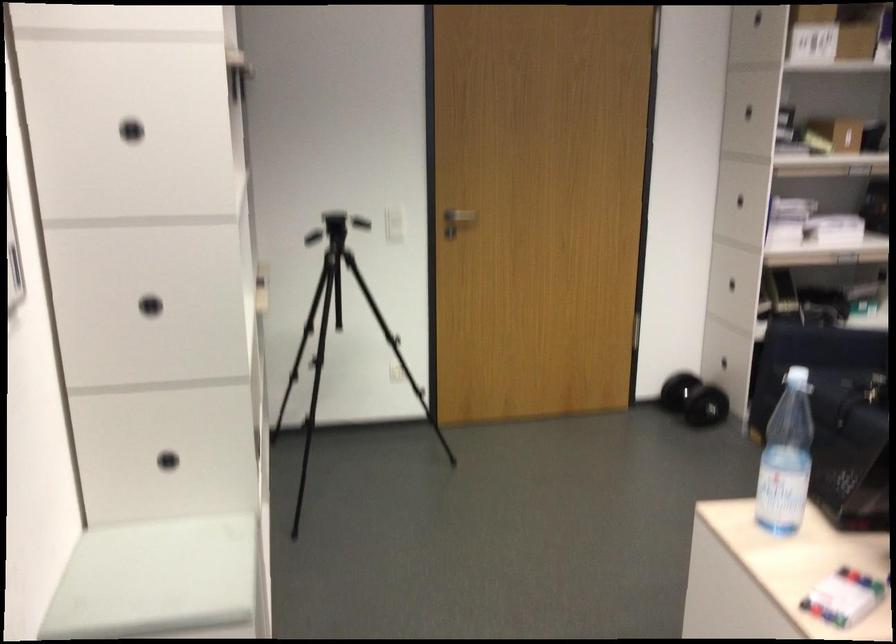
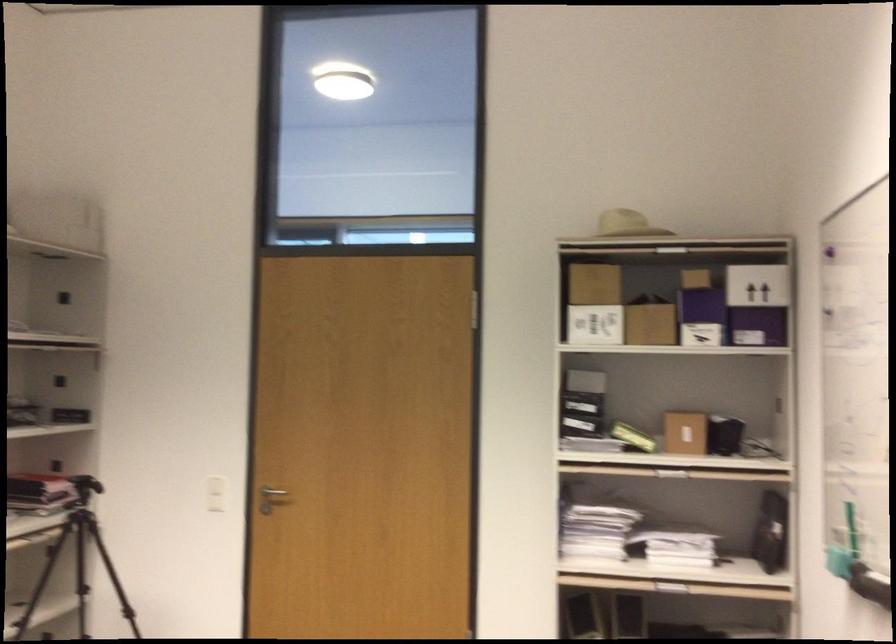
Find the pixel in the second image that matches the point at 426,218 in the first image.

(272, 491)